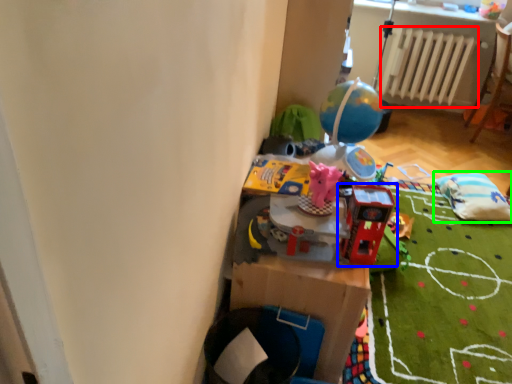
Question: Based on their relative distances, which object is farther from radiator (highlighted by a red box)? Choose from toy (highlighted by a blue box) and bean bag chair (highlighted by a green box).

Choices:
 (A) toy
 (B) bean bag chair

Answer: (A)